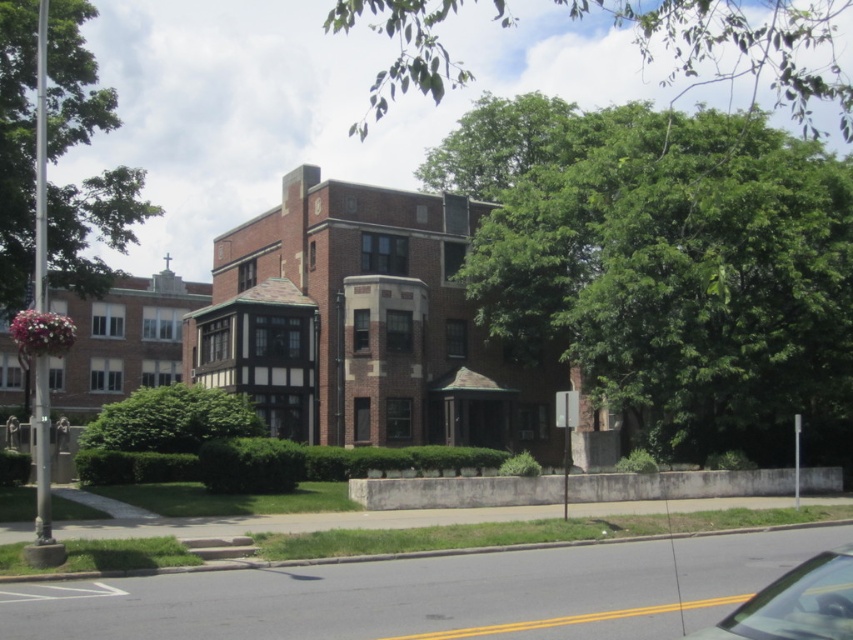
You are a delivery person trying to park your metallic silver car at lower right near the building. There is a green leafy tree at upper center in the way. Can you drive your car around it without hitting the tree?

The green leafy tree at upper center is taller than metallic silver car at lower right, so you can drive your car around it as the tree is taller but does not block the path at ground level.

You are standing in front of the building and want to determine the relative positions of two points marked on the facade. Which point, point 1 at coordinates point (711, 320) or point 2 at coordinates point (749, 630), is closer to you?

Point 1 at coordinates point (711, 320) is closer to you because it is further to the viewer than point 2 at coordinates point (749, 630).

You are standing in front of the building and want to park your car so that it is hidden from view by the tree. Is the metallic silver car at lower right currently positioned in a way that it is obscured by the green leafy tree at upper center?

Yes, the metallic silver car at lower right is behind the green leafy tree at upper center, so it is currently obscured by the tree.